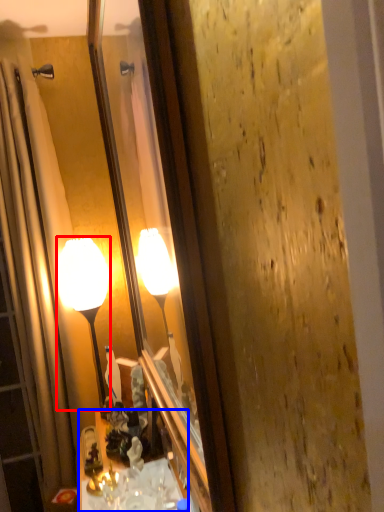
Question: Which point is further to the camera, lamp (highlighted by a red box) or cabinetry (highlighted by a blue box)?

Choices:
 (A) lamp
 (B) cabinetry

Answer: (A)